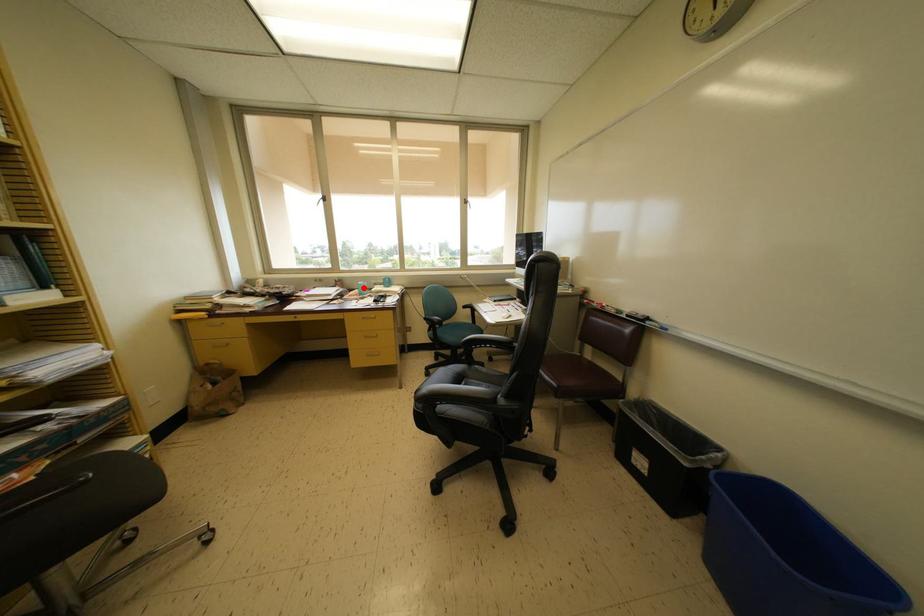
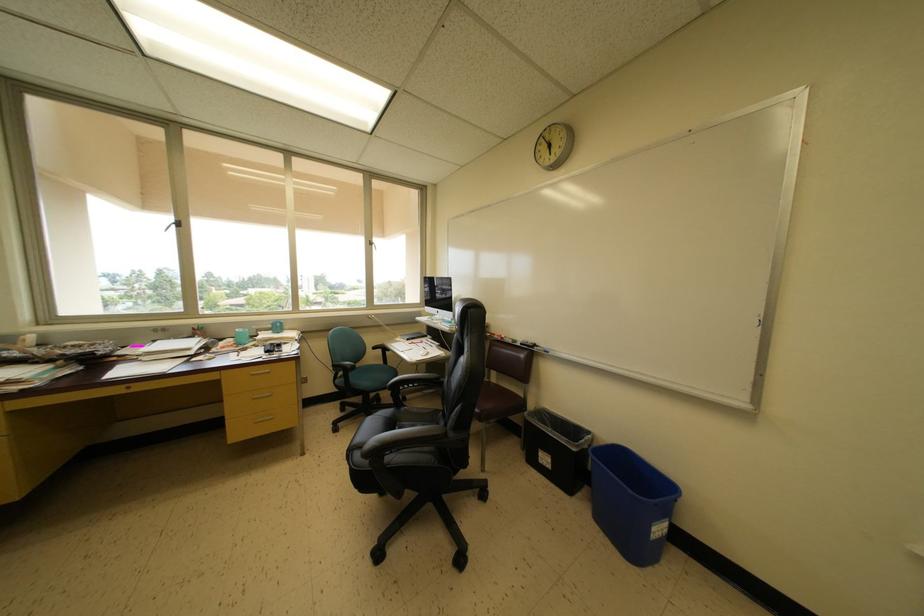
Find the pixel in the second image that matches the highlighted location in the first image.

(240, 334)